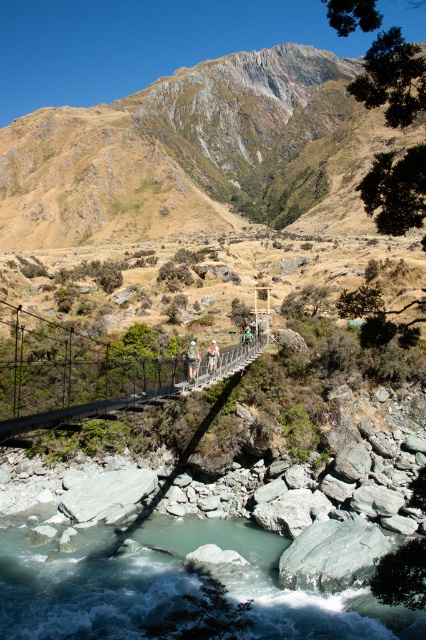
You are standing on the metallic wire bridge at center and looking towards the white fabric person at center. Which object is closer to you according to the scene?

The metallic wire bridge at center is closer to you than the white fabric person at center because it is in front of the white fabric person at center in the scene.

In the scene shown: You are a hiker standing on the suspension bridge and notice a light brown fabric jacket at center. If you want to pick it up, which direction should you move relative to your current position at point 0.5, 0.5?

The light brown fabric jacket at center is located at point (192, 360). Since your current position is at (213, 320), you should move slightly to the right and down to reach it.

You are a hiker standing on the suspension bridge and want to take a photo of the rugged brown rock at upper center and the clear quartz water at lower center. Which object is positioned higher in the frame?

The rugged brown rock at upper center is located above the clear quartz water at lower center, so it is positioned higher in the frame.